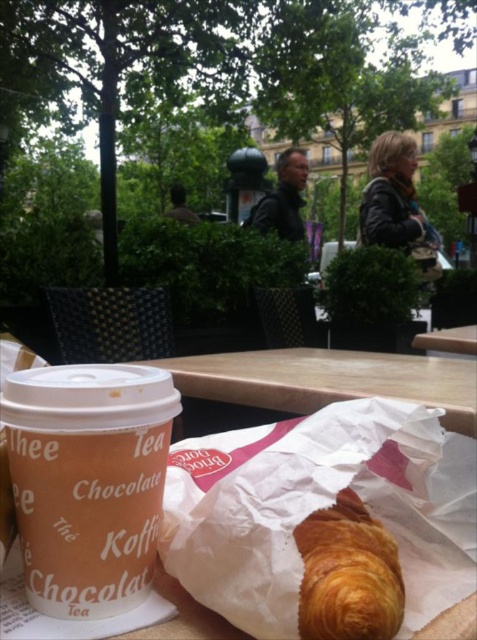
You are a customer at the outdoor cafe and want to know which item is taller between the brown paper cup at lower left and the golden flaky croissant at center. Can you tell me?

The brown paper cup at lower left is taller than the golden flaky croissant at center.

You are at a cafe and want to place a small sugar packet on the table. The sugar packet is 3 cm in diameter. The point marked as point (87, 481) is where the brown paper cup is located. Where should you place the sugar packet so it doesn t fall off the table? Please provide coordinates in the same format as the point given.

The point marked as point (87, 481) indicates the location of the brown paper cup at lower left. To place the sugar packet safely, position it away from the edge of the table. Since the cup is at lower left, placing the sugar packet near the center of the table would be safest. However, without specific table dimensions, the safest bet is to place it near the center opposite the cup. For example, coordinates around 0.247, 0.816 might work, but this is speculative. The exact answer requires table size.